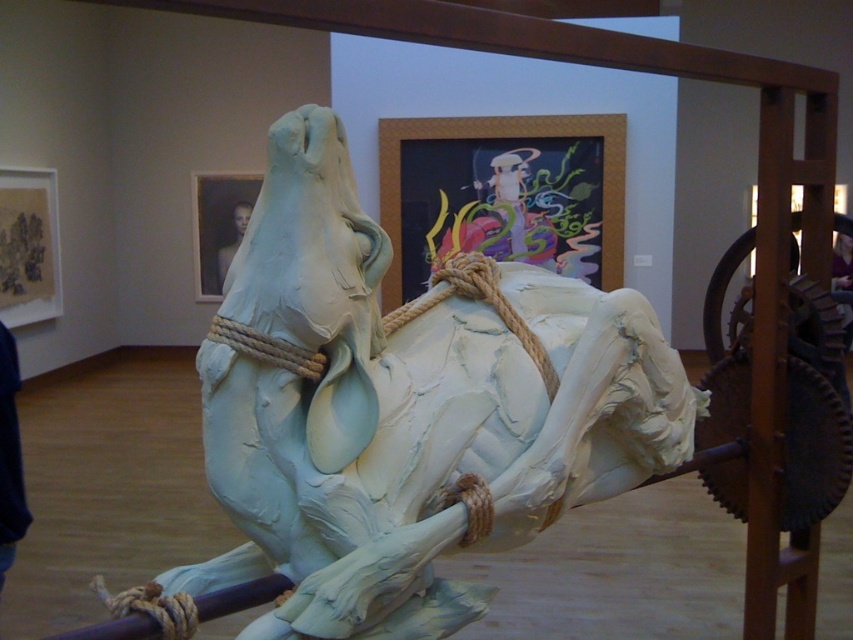
Question: Which point is farther from the camera taking this photo?

Choices:
 (A) (279, 342)
 (B) (668, 406)

Answer: (B)

Question: Is white clay horse at center behind roperoughrope at center?

Choices:
 (A) yes
 (B) no

Answer: (B)

Question: Which point appears closest to the camera in this image?

Choices:
 (A) (456, 275)
 (B) (242, 204)
 (C) (387, 532)

Answer: (C)

Question: Does white clay horse at center have a greater width compared to smooth skin man at upper center?

Choices:
 (A) yes
 (B) no

Answer: (A)

Question: Can you confirm if roperoughrope at center is wider than smooth skin man at upper center?

Choices:
 (A) yes
 (B) no

Answer: (B)

Question: Estimate the real-world distances between objects in this image. Which object is closer to the smooth skin man at upper center?

Choices:
 (A) roperoughrope at center
 (B) white clay horse at center

Answer: (A)